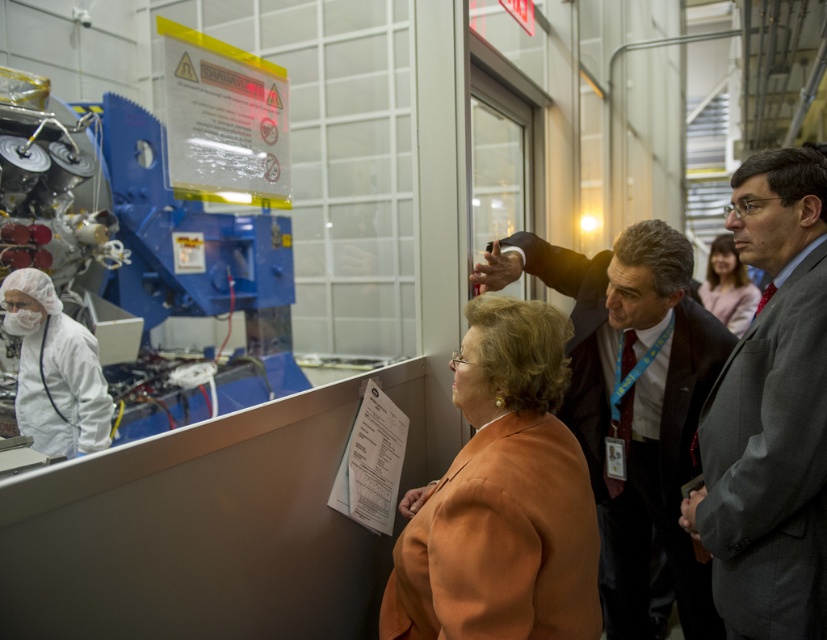
Looking at this image, you are a security guard who needs to ensure that two people, the gray suit at center and the dark suit at center, are maintaining a safe distance of at least 15 inches apart. Based on the scene provided, are they complying with the safety regulations?

The gray suit at center and dark suit at center are 14.13 inches apart from each other, which is less than the required 15 inches. Therefore, they are not complying with the safety regulations.

You are standing in the laboratory and need to locate the orange fabric jacket at center. According to the coordinates provided, where exactly is it positioned?

The orange fabric jacket at center is located at point 0.778 on the x axis and 0.608 on the y axis.

You are an event planner organizing a photoshoot in this lab setting. You need to position two models wearing the gray suit at center and matte orange blazer at center so that their outfits are clearly visible. Which model should stand closer to the camera to ensure their outfit details are captured better?

The gray suit at center is thinner than the matte orange blazer at center, so the model wearing the gray suit at center should stand closer to the camera to ensure its details are visible without being overshadowed by the wider matte orange blazer at center.